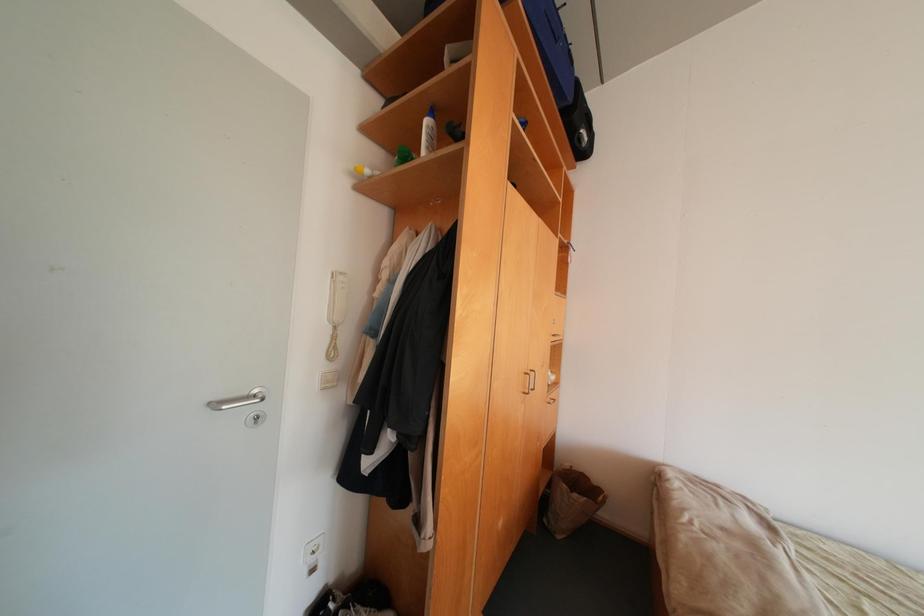
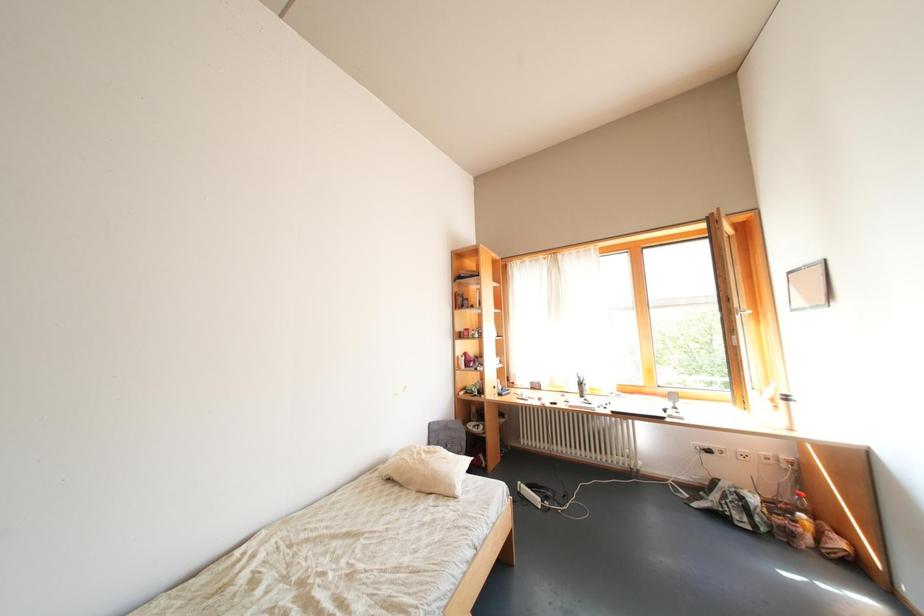
Question: The images are taken continuously from a first-person perspective. In which direction is your viewpoint rotating?

Choices:
 (A) Left
 (B) Right
 (C) Up
 (D) Down

Answer: (B)